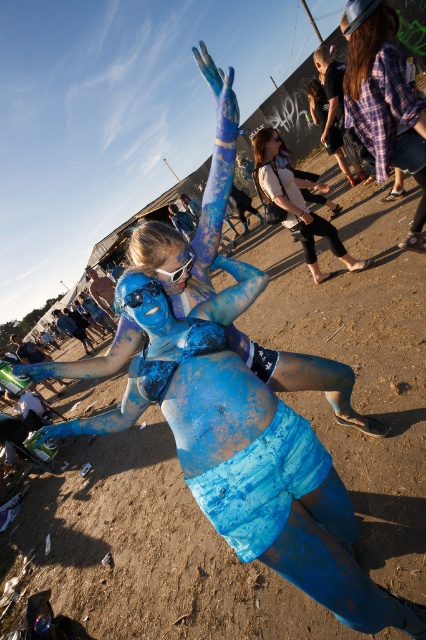
Question: Which point appears closest to the camera in this image?

Choices:
 (A) (189, 266)
 (B) (123, 300)
 (C) (354, 35)
 (D) (296, 182)

Answer: (B)

Question: Can you confirm if plaid fabric shirt at upper right is thinner than blue matte face at center?

Choices:
 (A) no
 (B) yes

Answer: (A)

Question: Does white textured shirt at center have a larger size compared to blue matte face at center?

Choices:
 (A) no
 (B) yes

Answer: (B)

Question: Which of the following is the closest to the observer?

Choices:
 (A) plaid fabric shirt at upper right
 (B) blue matte face at center
 (C) matte blue camera at center

Answer: (C)

Question: Based on their relative distances, which object is nearer to the matte blue face at center?

Choices:
 (A) plaid fabric shirt at upper right
 (B) matte blue camera at center

Answer: (B)

Question: Is matte blue face at center further to the viewer compared to blue matte face at center?

Choices:
 (A) yes
 (B) no

Answer: (B)